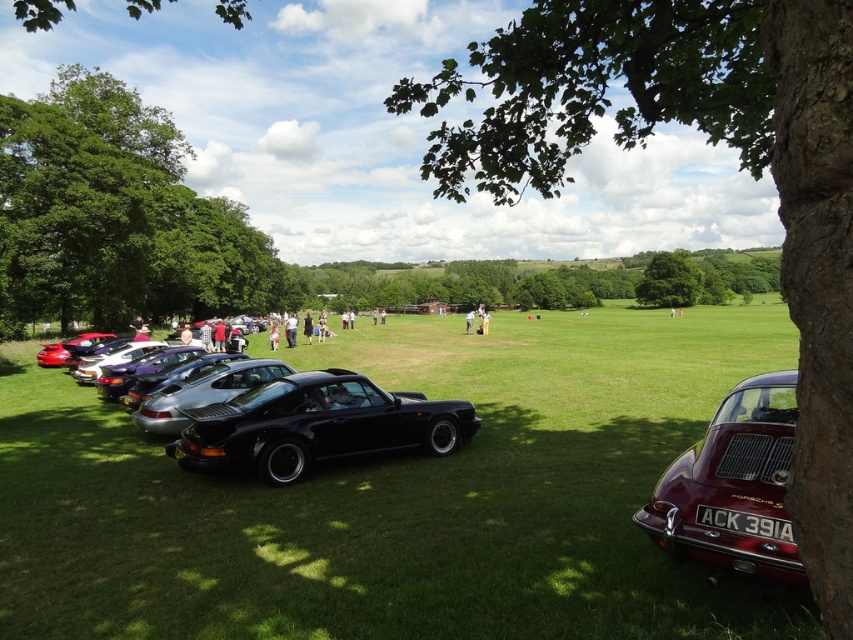
You are a photographer standing at the edge of the grassy field. You want to take a photo of the light brown leather jacket at center without the green leafy tree at upper right blocking it. What should you do?

Move to the left side of the light brown leather jacket at center so that the green leafy tree at upper right is no longer above it, allowing an unobstructed view of the jacket.

You are a photographer trying to capture both the black glossy car at center and the metallic purple car at lower left in a single shot. Based on their positions, which car is closer to the camera?

The black glossy car at center is positioned under the metallic purple car at lower left, meaning it is closer to the camera.

You are standing in the grassy field and want to walk from the green leafy tree at left to the green leafy tree at upper right. Which direction should you head?

You should head to the right because the green leafy tree at upper right is located to the right of the green leafy tree at left.